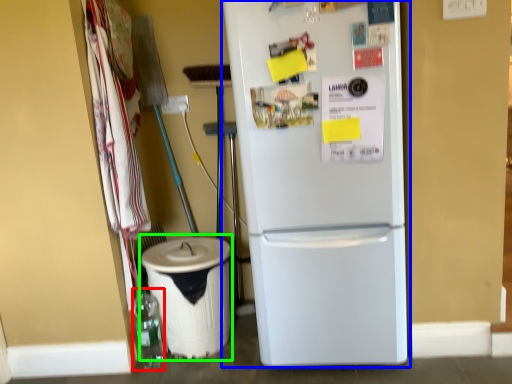
Question: Considering the real-world distances, which object is closest to bottle (highlighted by a red box)? refrigerator (highlighted by a blue box) or recycling bin (highlighted by a green box).

Choices:
 (A) refrigerator
 (B) recycling bin

Answer: (B)